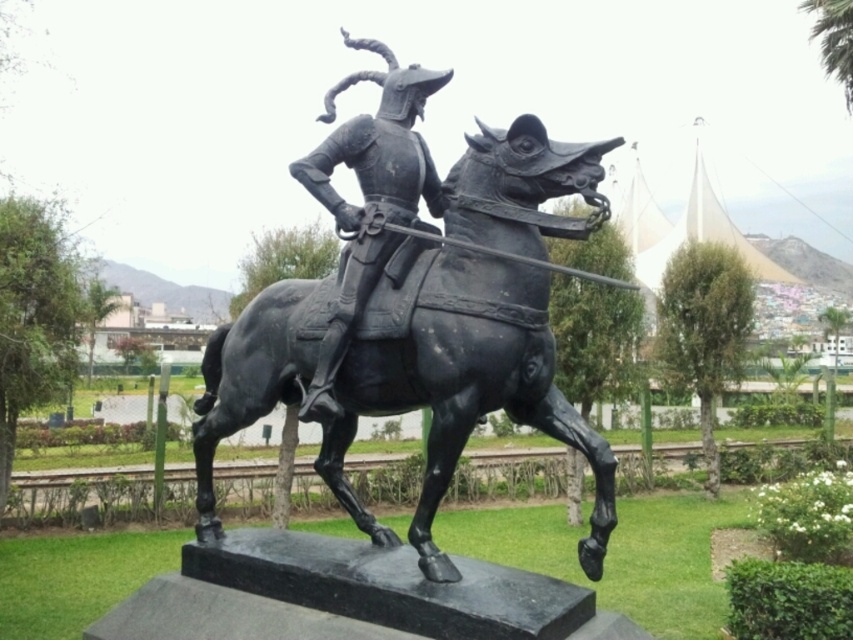
Question: Which object is closer to the camera taking this photo?

Choices:
 (A) black polished horse at center
 (B) black polished metal horseman at center

Answer: (A)

Question: Which point is farther from the camera taking this photo?

Choices:
 (A) (572, 168)
 (B) (392, 108)

Answer: (B)

Question: Does black polished horse at center appear over black polished metal horseman at center?

Choices:
 (A) no
 (B) yes

Answer: (A)

Question: Can you confirm if black polished horse at center is positioned to the right of black polished metal horseman at center?

Choices:
 (A) yes
 (B) no

Answer: (A)

Question: Is black polished horse at center bigger than black polished metal horseman at center?

Choices:
 (A) no
 (B) yes

Answer: (B)